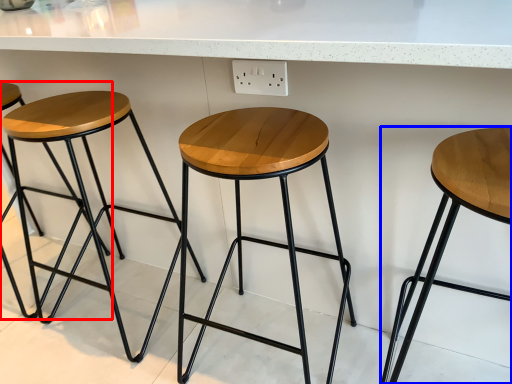
Question: Which object appears closest to the camera in this image, stool (highlighted by a red box) or stool (highlighted by a blue box)?

Choices:
 (A) stool
 (B) stool

Answer: (B)